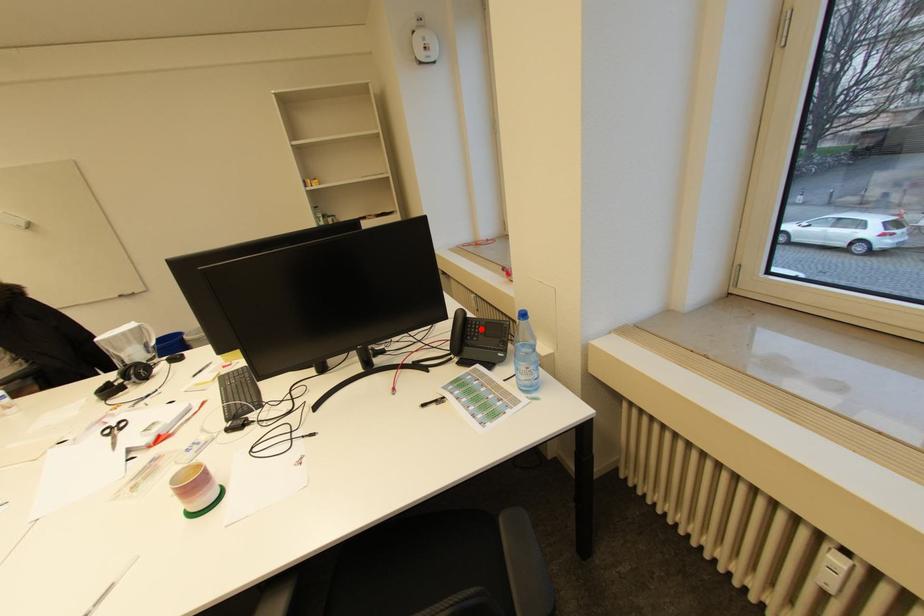
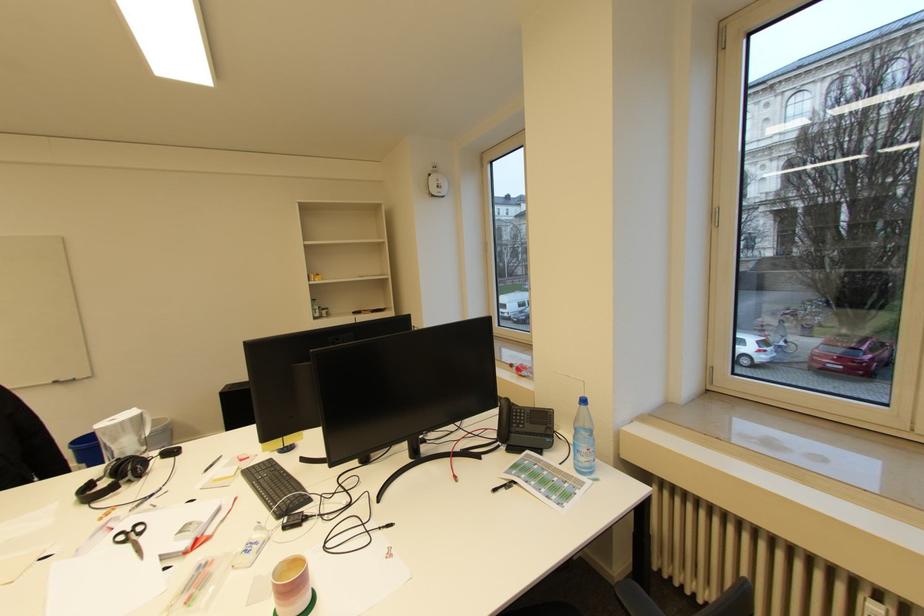
The point at the highlighted location is marked in the first image. Where is the corresponding point in the second image?

(527, 416)